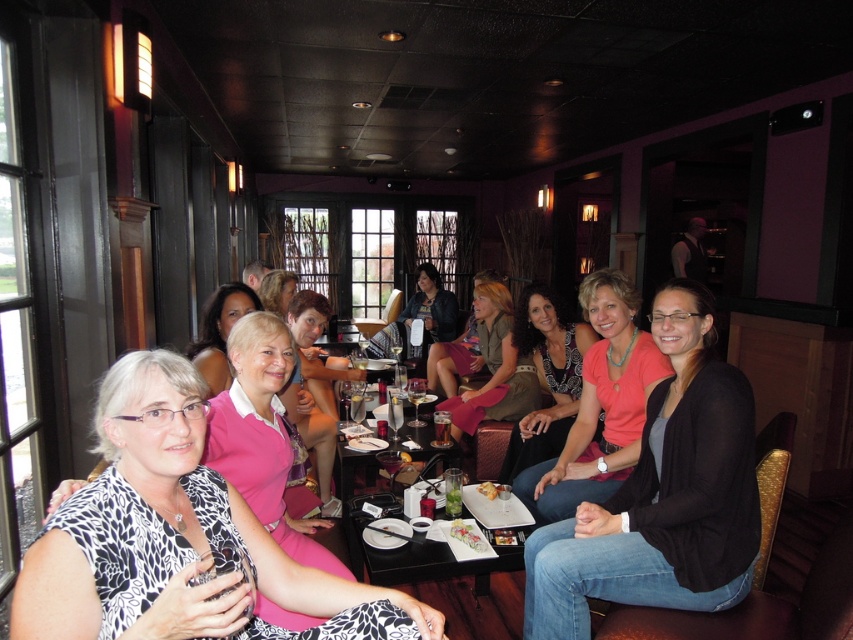
What are the coordinates of `denim jeans at center` in the screenshot? It's located at (662, 493).

Is point (697, 369) in front of point (273, 269)?

Yes.

What do you see at coordinates (662, 493) in the screenshot? The height and width of the screenshot is (640, 853). I see `denim jeans at center` at bounding box center [662, 493].

At what (x,y) coordinates should I click in order to perform the action: click on denim jeans at center. Please return your answer as a coordinate pair (x, y). This screenshot has height=640, width=853. Looking at the image, I should click on (662, 493).

Between pink fabric dress at center and pink matte shirt at center, which one is positioned lower?

pink fabric dress at center

Is pink fabric dress at center thinner than pink matte shirt at center?

Incorrect, pink fabric dress at center's width is not less than pink matte shirt at center's.

Describe the element at coordinates (314, 387) in the screenshot. The width and height of the screenshot is (853, 640). I see `pink fabric dress at center` at that location.

The image size is (853, 640). In order to click on pink fabric dress at center in this screenshot , I will do `click(314, 387)`.

Measure the distance between printed fabric dress at center and camera.

The distance of printed fabric dress at center from camera is 3.34 feet.

Can you confirm if printed fabric dress at center is bigger than glassy clear glass at center?

Actually, printed fabric dress at center might be smaller than glassy clear glass at center.

Which is in front, point (51, 550) or point (422, 428)?

Point (51, 550)

The height and width of the screenshot is (640, 853). I want to click on printed fabric dress at center, so click(x=177, y=538).